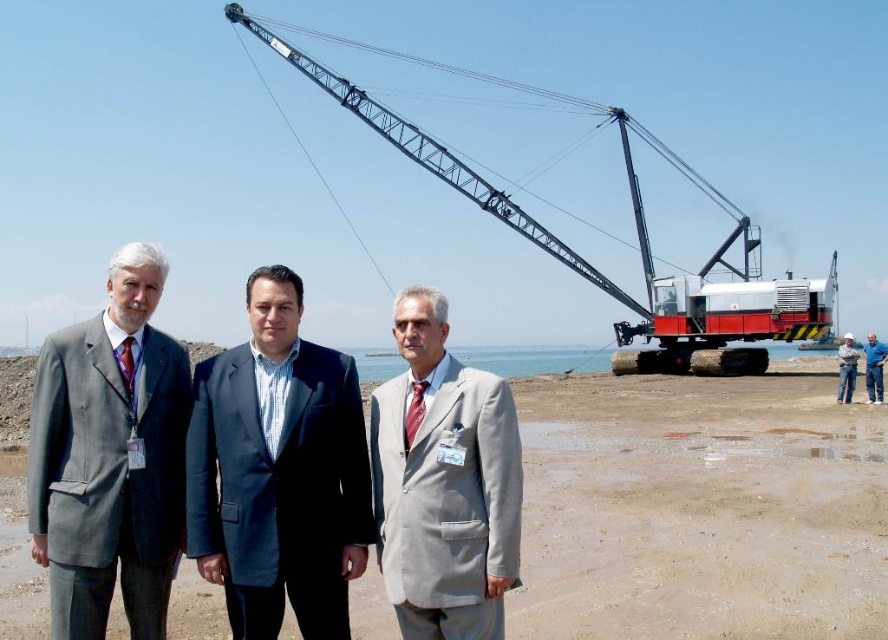
Based on the coordinates provided in the Objects Description, where is the metallic gray crane at upper center located in the image?

The metallic gray crane at upper center is located at point coordinates of 0.383 on the x axis and 0.639 on the y axis.

You are a safety inspector at the construction site. You need to check the distance between the gray fabric suit at center and the white hard hat at center to ensure safety protocols are followed. What is the width comparison between them?

The gray fabric suit at center has a lesser width compared to the white hard hat at center, so the safety protocols are being followed as the hard hat is wider for better visibility.